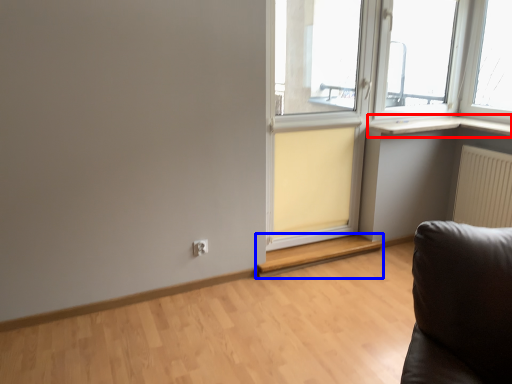
Question: Which of the following is the farthest to the observer, window sill (highlighted by a red box) or window (highlighted by a blue box)?

Choices:
 (A) window sill
 (B) window

Answer: (A)